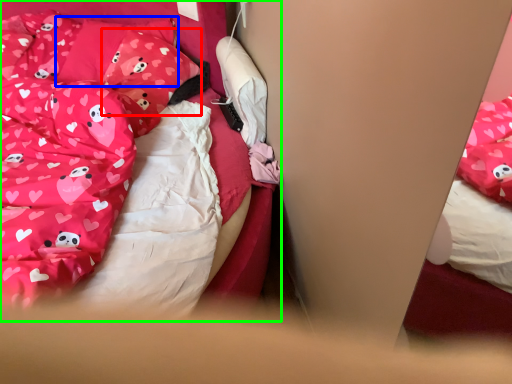
Question: Which is farther away from pillow (highlighted by a red box)? pillow (highlighted by a blue box) or bed (highlighted by a green box)?

Choices:
 (A) pillow
 (B) bed

Answer: (B)